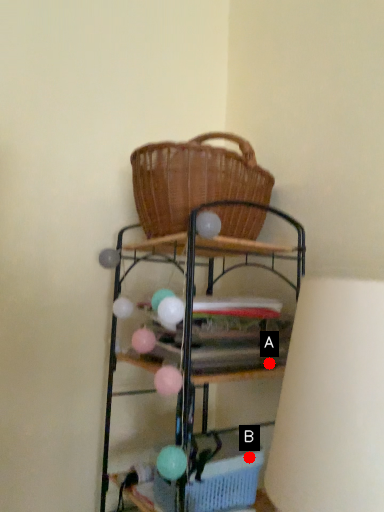
Question: Two points are circled on the image, labeled by A and B beside each circle. Which point is farther from the camera taking this photo?

Choices:
 (A) A is further
 (B) B is further

Answer: (A)